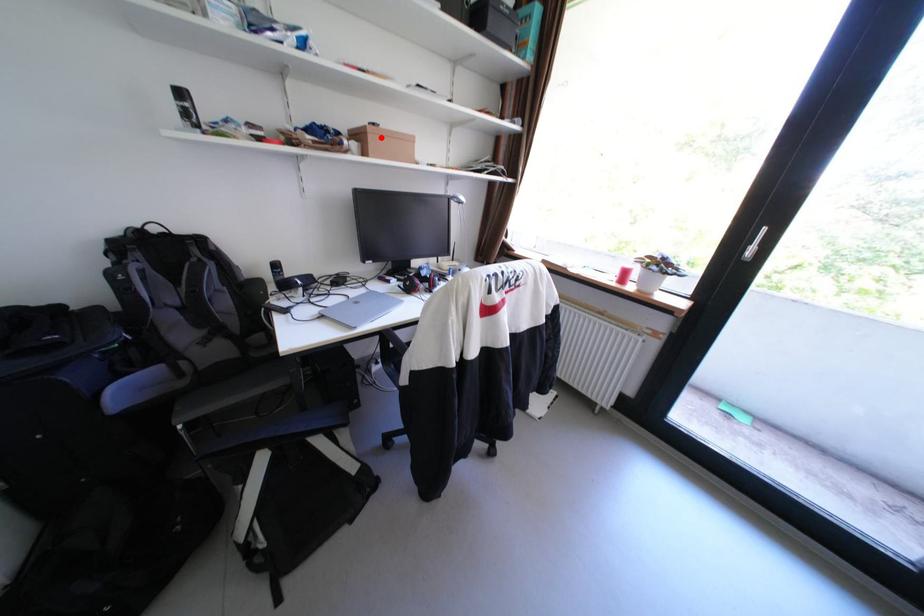
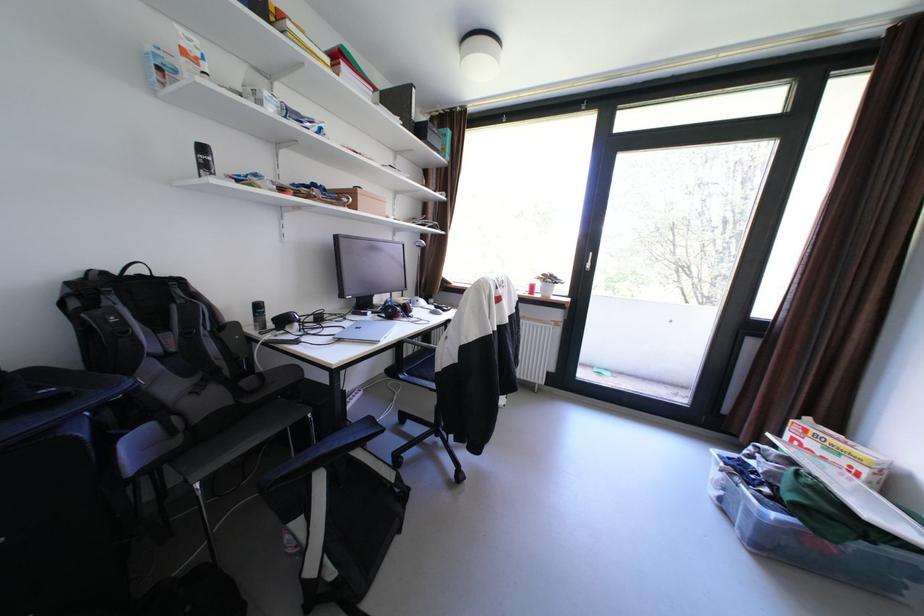
Where in the second image is the point corresponding to the highlighted location from the first image?

(370, 197)